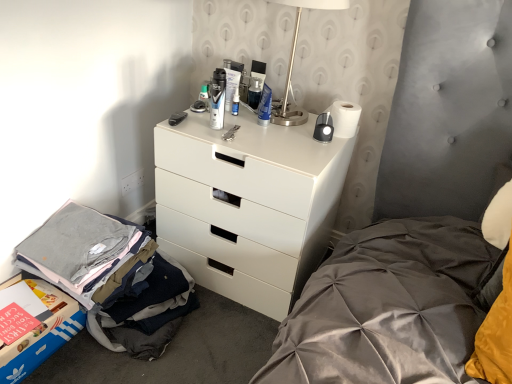
I want to click on vacant area that lies between satin silver table lamp at upper right and matte black shaving cream can at center, acting as the 4th toiletry starting from the right, so click(x=246, y=129).